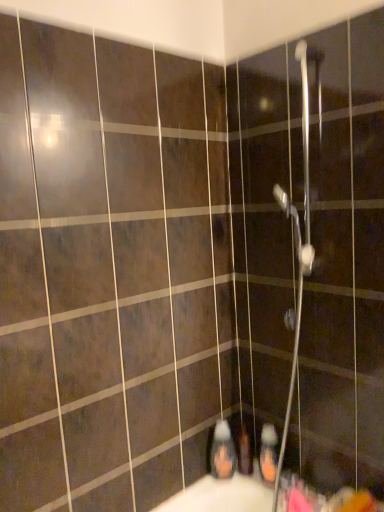
This screenshot has height=512, width=384. Describe the element at coordinates (345, 234) in the screenshot. I see `metallic silver shower head at upper center` at that location.

This screenshot has width=384, height=512. Identify the location of matte plastic toothbrush at lower center, which is the second toiletry in right-to-left order. (244, 449).

Measure the distance between point (263, 438) and camera.

Point (263, 438) and camera are 4.82 feet apart from each other.

Describe the element at coordinates (222, 451) in the screenshot. I see `translucent plastic soap dispenser at lower center, placed as the third toiletry when sorted from right to left` at that location.

You are a GUI agent. You are given a task and a screenshot of the screen. Output one action in this format:
    pyautogui.click(x=<x>, y=<y>)
    Task: Click on the metallic silver shower head at upper center
    This screenshot has height=512, width=384.
    Given the screenshot: What is the action you would take?
    pyautogui.click(x=345, y=234)

Is point (249, 474) positioned after point (272, 436)?

Yes, point (249, 474) is behind point (272, 436).

Which of these two, matte plastic toothbrush at lower center, which is the second toiletry in right-to-left order, or orange matte bottle at lower center, the 1th toiletry viewed from the right, is wider?

orange matte bottle at lower center, the 1th toiletry viewed from the right.

Is matte plastic toothbrush at lower center, which is the second toiletry in right-to-left order, smaller than orange matte bottle at lower center, which is the 3th toiletry in left-to-right order?

Yes.

In the image, is orange matte bottle at lower center, the 1th toiletry viewed from the right, positioned in front of or behind matte plastic toothbrush at lower center, which is the second toiletry in right-to-left order?

Clearly, orange matte bottle at lower center, the 1th toiletry viewed from the right, is in front of matte plastic toothbrush at lower center, which is the second toiletry in right-to-left order.

Is orange matte bottle at lower center, the 1th toiletry viewed from the right, far away from matte plastic toothbrush at lower center, which is the second toiletry in right-to-left order?

Actually, orange matte bottle at lower center, the 1th toiletry viewed from the right, and matte plastic toothbrush at lower center, which is the second toiletry in right-to-left order, are a little close together.

Looking at this image, which is more to the right, orange matte bottle at lower center, which is the 3th toiletry in left-to-right order, or matte plastic toothbrush at lower center, placed as the 2th toiletry when sorted from left to right?

Positioned to the right is orange matte bottle at lower center, which is the 3th toiletry in left-to-right order.

From the image's perspective, which toiletry is the 2nd one above the matte plastic toothbrush at lower center, placed as the 2th toiletry when sorted from left to right? Please provide its 2D coordinates.

[(268, 454)]

Consider the image. Can you confirm if orange matte bottle at lower center, which is the 3th toiletry in left-to-right order, is shorter than metallic silver shower head at upper center?

Correct, orange matte bottle at lower center, which is the 3th toiletry in left-to-right order, is not as tall as metallic silver shower head at upper center.

In the scene shown: Measure the distance from orange matte bottle at lower center, the 1th toiletry viewed from the right, to metallic silver shower head at upper center.

They are 24.70 inches apart.

Which object is further away from the camera taking this photo, orange matte bottle at lower center, the 1th toiletry viewed from the right, or metallic silver shower head at upper center?

Positioned behind is orange matte bottle at lower center, the 1th toiletry viewed from the right.

Considering the positions of objects orange matte bottle at lower center, which is the 3th toiletry in left-to-right order, and metallic silver shower head at upper center in the image provided, who is more to the right, orange matte bottle at lower center, which is the 3th toiletry in left-to-right order, or metallic silver shower head at upper center?

From the viewer's perspective, metallic silver shower head at upper center appears more on the right side.

From the image's perspective, which object appears higher, metallic silver shower head at upper center or matte plastic toothbrush at lower center, which is the second toiletry in right-to-left order?

metallic silver shower head at upper center.

Is metallic silver shower head at upper center wider than matte plastic toothbrush at lower center, which is the second toiletry in right-to-left order?

Indeed, metallic silver shower head at upper center has a greater width compared to matte plastic toothbrush at lower center, which is the second toiletry in right-to-left order.

Is metallic silver shower head at upper center oriented away from matte plastic toothbrush at lower center, placed as the 2th toiletry when sorted from left to right?

No, metallic silver shower head at upper center is not facing away from matte plastic toothbrush at lower center, placed as the 2th toiletry when sorted from left to right.

Is metallic silver shower head at upper center directly adjacent to matte plastic toothbrush at lower center, which is the second toiletry in right-to-left order?

There is a gap between metallic silver shower head at upper center and matte plastic toothbrush at lower center, which is the second toiletry in right-to-left order.

Is metallic silver shower head at upper center facing away from translucent plastic soap dispenser at lower center, which is the 1th toiletry in left-to-right order?

No, metallic silver shower head at upper center is not facing away from translucent plastic soap dispenser at lower center, which is the 1th toiletry in left-to-right order.

Where is `screen door above the translucent plastic soap dispenser at lower center, which is the 1th toiletry in left-to-right order (from the image's perspective)`? The image size is (384, 512). screen door above the translucent plastic soap dispenser at lower center, which is the 1th toiletry in left-to-right order (from the image's perspective) is located at coordinates (345, 234).

Is translucent plastic soap dispenser at lower center, which is the 1th toiletry in left-to-right order, inside metallic silver shower head at upper center?

No, translucent plastic soap dispenser at lower center, which is the 1th toiletry in left-to-right order, is not inside metallic silver shower head at upper center.

Which is in front, metallic silver shower head at upper center or translucent plastic soap dispenser at lower center, which is the 1th toiletry in left-to-right order?

metallic silver shower head at upper center.

From a real-world perspective, is orange matte bottle at lower center, the 1th toiletry viewed from the right, over translucent plastic soap dispenser at lower center, placed as the third toiletry when sorted from right to left?

Incorrect, from a real-world perspective, orange matte bottle at lower center, the 1th toiletry viewed from the right, is lower than translucent plastic soap dispenser at lower center, placed as the third toiletry when sorted from right to left.

Between orange matte bottle at lower center, which is the 3th toiletry in left-to-right order, and translucent plastic soap dispenser at lower center, which is the 1th toiletry in left-to-right order, which one appears on the right side from the viewer's perspective?

From the viewer's perspective, orange matte bottle at lower center, which is the 3th toiletry in left-to-right order, appears more on the right side.

Which object is closer to the camera, orange matte bottle at lower center, which is the 3th toiletry in left-to-right order, or translucent plastic soap dispenser at lower center, placed as the third toiletry when sorted from right to left?

orange matte bottle at lower center, which is the 3th toiletry in left-to-right order, is more forward.

Measure the distance between orange matte bottle at lower center, the 1th toiletry viewed from the right, and translucent plastic soap dispenser at lower center, which is the 1th toiletry in left-to-right order.

A distance of 5.59 inches exists between orange matte bottle at lower center, the 1th toiletry viewed from the right, and translucent plastic soap dispenser at lower center, which is the 1th toiletry in left-to-right order.

Could you measure the distance between translucent plastic soap dispenser at lower center, placed as the third toiletry when sorted from right to left, and orange matte bottle at lower center, the 1th toiletry viewed from the right?

5.59 inches.

Is translucent plastic soap dispenser at lower center, placed as the third toiletry when sorted from right to left, shorter than orange matte bottle at lower center, which is the 3th toiletry in left-to-right order?

Incorrect, the height of translucent plastic soap dispenser at lower center, placed as the third toiletry when sorted from right to left, does not fall short of that of orange matte bottle at lower center, which is the 3th toiletry in left-to-right order.

Which object is positioned more to the left, translucent plastic soap dispenser at lower center, placed as the third toiletry when sorted from right to left, or orange matte bottle at lower center, which is the 3th toiletry in left-to-right order?

From the viewer's perspective, translucent plastic soap dispenser at lower center, placed as the third toiletry when sorted from right to left, appears more on the left side.

From a real-world perspective, which object stands above the other?

translucent plastic soap dispenser at lower center, placed as the third toiletry when sorted from right to left.

Where is `toiletry below the orange matte bottle at lower center, which is the 3th toiletry in left-to-right order (from a real-world perspective)`? This screenshot has width=384, height=512. toiletry below the orange matte bottle at lower center, which is the 3th toiletry in left-to-right order (from a real-world perspective) is located at coordinates (244, 449).

This screenshot has height=512, width=384. I want to click on toiletry that is the 1st object to the left of the orange matte bottle at lower center, the 1th toiletry viewed from the right, starting at the anchor, so click(x=244, y=449).

When comparing their distances from matte plastic toothbrush at lower center, placed as the 2th toiletry when sorted from left to right, does metallic silver shower head at upper center or translucent plastic soap dispenser at lower center, which is the 1th toiletry in left-to-right order, seem further?

metallic silver shower head at upper center.

From the image, which object appears to be nearer to translucent plastic soap dispenser at lower center, which is the 1th toiletry in left-to-right order, matte plastic toothbrush at lower center, placed as the 2th toiletry when sorted from left to right, or metallic silver shower head at upper center?

matte plastic toothbrush at lower center, placed as the 2th toiletry when sorted from left to right, is positioned closer to the anchor translucent plastic soap dispenser at lower center, which is the 1th toiletry in left-to-right order.

Considering their positions, is orange matte bottle at lower center, the 1th toiletry viewed from the right, positioned closer to matte plastic toothbrush at lower center, placed as the 2th toiletry when sorted from left to right, than translucent plastic soap dispenser at lower center, which is the 1th toiletry in left-to-right order?

Among the two, translucent plastic soap dispenser at lower center, which is the 1th toiletry in left-to-right order, is located nearer to matte plastic toothbrush at lower center, placed as the 2th toiletry when sorted from left to right.

Based on their spatial positions, is translucent plastic soap dispenser at lower center, placed as the third toiletry when sorted from right to left, or metallic silver shower head at upper center further from matte plastic toothbrush at lower center, which is the second toiletry in right-to-left order?

The object further to matte plastic toothbrush at lower center, which is the second toiletry in right-to-left order, is metallic silver shower head at upper center.

Looking at this image, looking at the image, which one is located further to translucent plastic soap dispenser at lower center, placed as the third toiletry when sorted from right to left, orange matte bottle at lower center, which is the 3th toiletry in left-to-right order, or matte plastic toothbrush at lower center, which is the second toiletry in right-to-left order?

orange matte bottle at lower center, which is the 3th toiletry in left-to-right order, lies further to translucent plastic soap dispenser at lower center, placed as the third toiletry when sorted from right to left, than the other object.

Which object lies further to the anchor point orange matte bottle at lower center, which is the 3th toiletry in left-to-right order, matte plastic toothbrush at lower center, which is the second toiletry in right-to-left order, or metallic silver shower head at upper center?

metallic silver shower head at upper center.

Looking at the image, which one is located further to metallic silver shower head at upper center, orange matte bottle at lower center, the 1th toiletry viewed from the right, or translucent plastic soap dispenser at lower center, placed as the third toiletry when sorted from right to left?

translucent plastic soap dispenser at lower center, placed as the third toiletry when sorted from right to left.

Estimate the real-world distances between objects in this image. Which object is further from metallic silver shower head at upper center, translucent plastic soap dispenser at lower center, which is the 1th toiletry in left-to-right order, or orange matte bottle at lower center, which is the 3th toiletry in left-to-right order?

translucent plastic soap dispenser at lower center, which is the 1th toiletry in left-to-right order, is further to metallic silver shower head at upper center.

Locate an element on the screen. toiletry between metallic silver shower head at upper center and translucent plastic soap dispenser at lower center, placed as the third toiletry when sorted from right to left, in the vertical direction is located at coordinates (268, 454).

At what (x,y) coordinates should I click in order to perform the action: click on toiletry between translucent plastic soap dispenser at lower center, placed as the third toiletry when sorted from right to left, and orange matte bottle at lower center, the 1th toiletry viewed from the right. Please return your answer as a coordinate pair (x, y). Looking at the image, I should click on (244, 449).